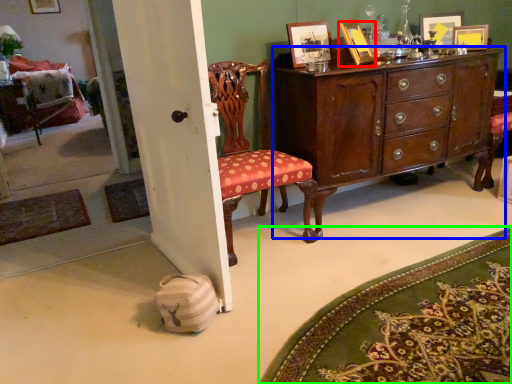
Question: Based on their relative distances, which object is nearer to picture frame (highlighted by a red box)? Choose from cabinetry (highlighted by a blue box) and mat (highlighted by a green box).

Choices:
 (A) cabinetry
 (B) mat

Answer: (A)